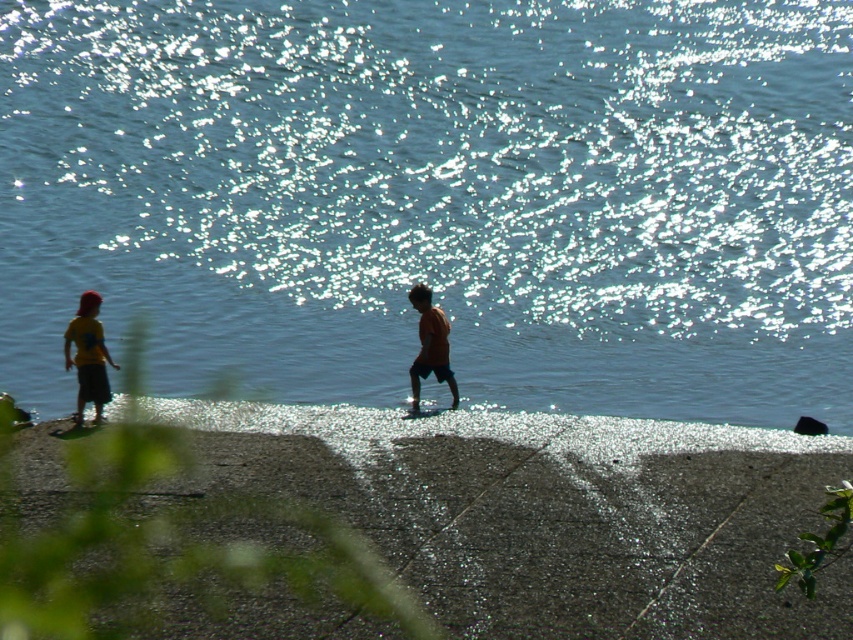
Question: Among these points, which one is nearest to the camera?

Choices:
 (A) (560, 605)
 (B) (430, 333)
 (C) (776, 148)
 (D) (96, 323)

Answer: (A)

Question: Is blue water at center thinner than orange matte shirt at center?

Choices:
 (A) yes
 (B) no

Answer: (B)

Question: Is smooth concrete sidewalk at lower center positioned in front of yellow matte shirt at left?

Choices:
 (A) yes
 (B) no

Answer: (A)

Question: Based on their relative distances, which object is farther from the orange matte shirt at center?

Choices:
 (A) smooth concrete sidewalk at lower center
 (B) blue water at center
 (C) yellow matte shirt at left

Answer: (B)

Question: Is yellow matte shirt at left smaller than orange matte shirt at center?

Choices:
 (A) no
 (B) yes

Answer: (A)

Question: Which object is positioned farthest from the smooth concrete sidewalk at lower center?

Choices:
 (A) blue water at center
 (B) orange matte shirt at center
 (C) yellow matte shirt at left

Answer: (A)